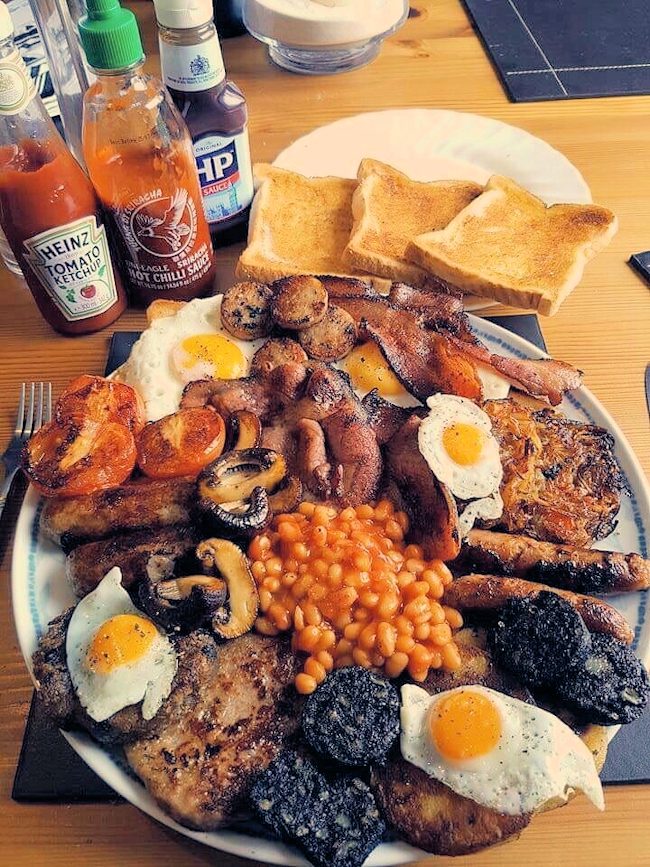
This screenshot has height=867, width=650. I want to click on fork, so click(8, 451).